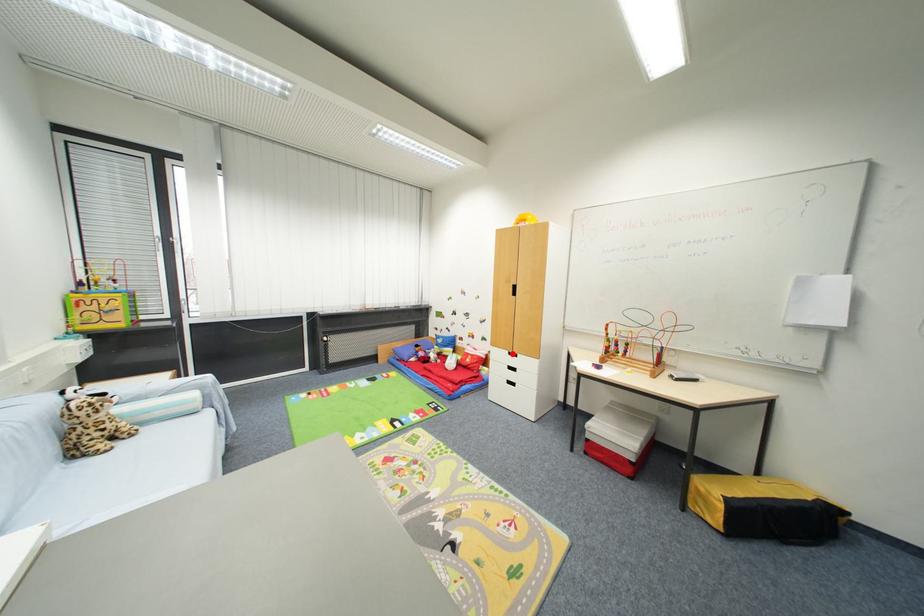
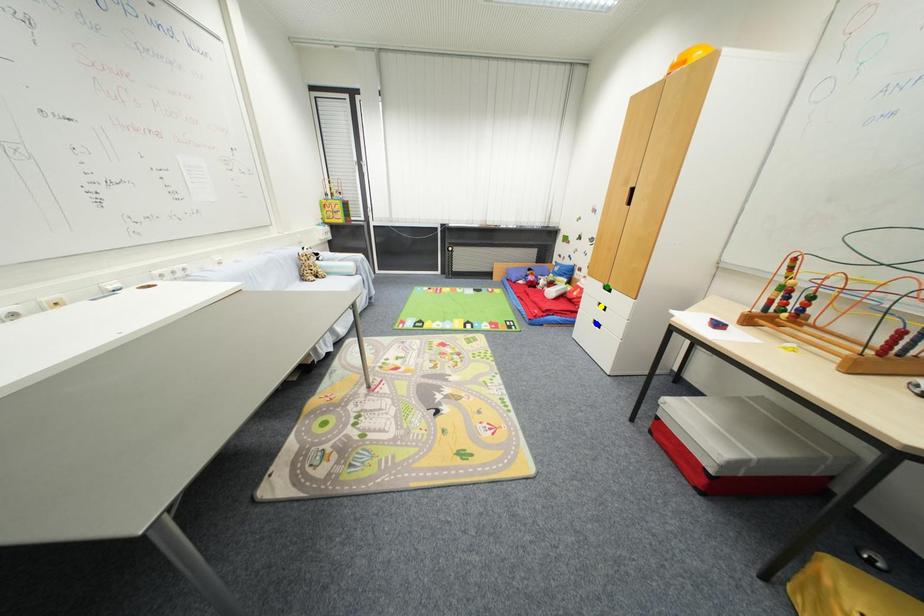
Question: I am providing you with two images of the same scene from different viewpoints. A red point is marked on the first image. You are given multiple points on the second image. Which mark in image 2 goes with the point in image 1?

Choices:
 (A) yellow point
 (B) green point
 (C) blue point

Answer: (B)